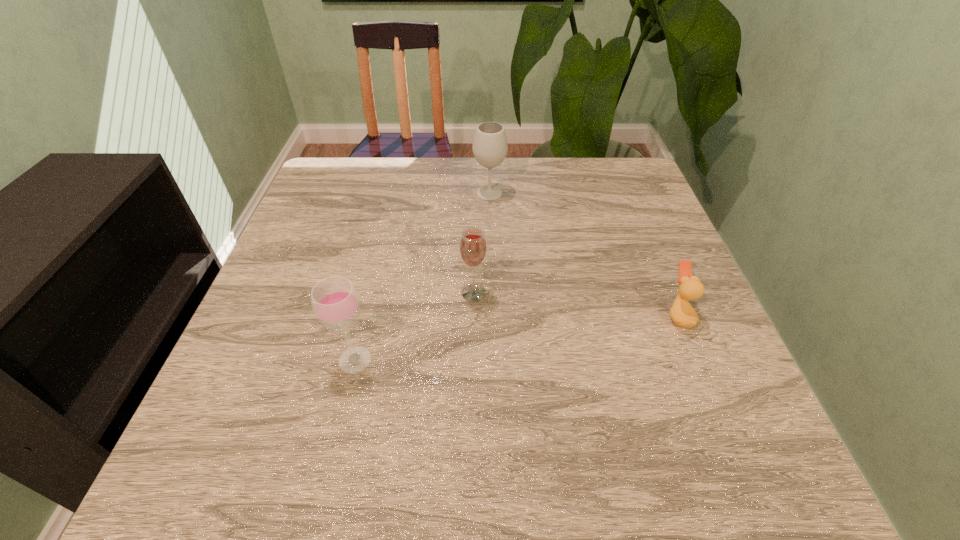
I want to click on the farthest object, so click(x=490, y=147).

Image resolution: width=960 pixels, height=540 pixels. What are the coordinates of `the nearest wineglass` in the screenshot? It's located at (335, 302).

Identify the location of the nearest object. (335, 302).

You are a GUI agent. You are given a task and a screenshot of the screen. Output one action in this format:
    pyautogui.click(x=<x>, y=<y>)
    Task: Click on the second farthest wineglass
    
    Given the screenshot: What is the action you would take?
    473,248

Locate an element on the screen. The height and width of the screenshot is (540, 960). the shortest object is located at coordinates (682, 313).

I want to click on duck, so click(682, 313).

This screenshot has width=960, height=540. I want to click on vacant space located 0.100m on the right of the farthest wineglass, so click(542, 193).

Find the location of a particular element. This screenshot has height=540, width=960. free space located on the left of the leftmost wineglass is located at coordinates (298, 360).

Where is `blank space located 0.060m on the left of the second farthest wineglass`? blank space located 0.060m on the left of the second farthest wineglass is located at coordinates (431, 293).

The image size is (960, 540). I want to click on free point located on the beak of the shortest object, so click(627, 315).